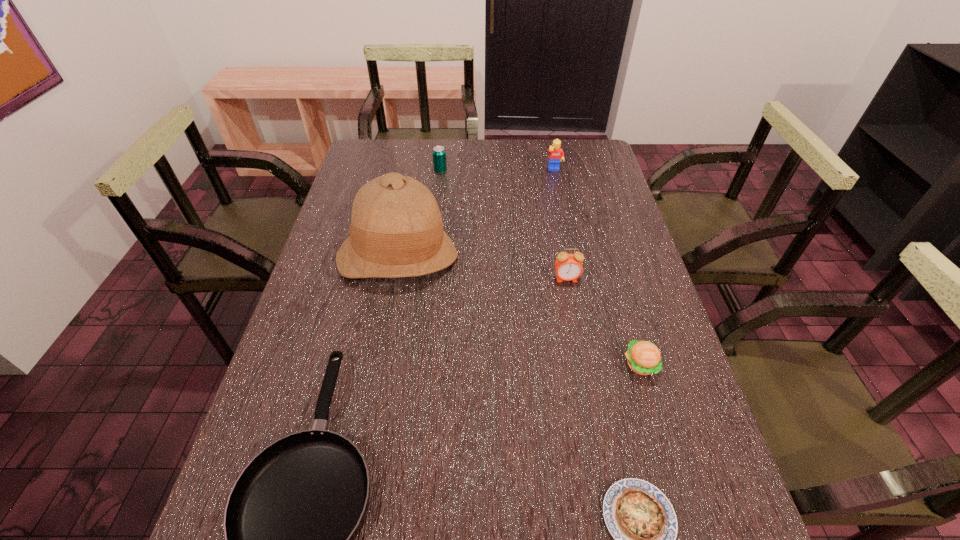
Locate an element on the screen. Lego present at the far edge is located at coordinates (556, 154).

Where is `beer can situated at the far edge`? Image resolution: width=960 pixels, height=540 pixels. beer can situated at the far edge is located at coordinates (439, 154).

In order to click on object that is at the left edge in this screenshot , I will do `click(396, 230)`.

Identify the location of Lego that is at the right edge. (556, 154).

Find the location of `hamburger that is at the right edge`. hamburger that is at the right edge is located at coordinates (643, 357).

At what (x,y) coordinates should I click in order to perform the action: click on object that is positioned at the far right corner. Please return your answer as a coordinate pair (x, y). Image resolution: width=960 pixels, height=540 pixels. Looking at the image, I should click on (556, 154).

The height and width of the screenshot is (540, 960). I want to click on vacant space at the far edge of the desktop, so click(x=550, y=139).

Identify the location of free space at the left edge of the desktop. Image resolution: width=960 pixels, height=540 pixels. (363, 283).

This screenshot has height=540, width=960. Find the location of `free region at the right edge of the desktop`. free region at the right edge of the desktop is located at coordinates (616, 226).

Find the location of a particular element. This screenshot has width=960, height=540. vacant space at the far left corner of the desktop is located at coordinates (357, 154).